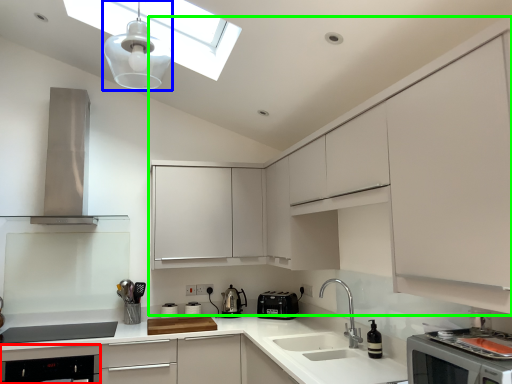
Question: Based on their relative distances, which object is farther from dish washer (highlighted by a red box)? Choose from light fixture (highlighted by a blue box) and cabinetry (highlighted by a green box).

Choices:
 (A) light fixture
 (B) cabinetry

Answer: (A)